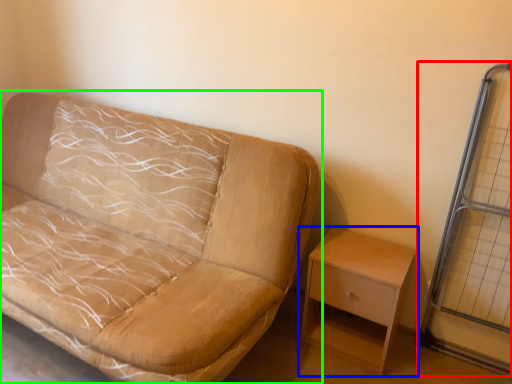
Question: Considering the real-world distances, which object is closest to glass door (highlighted by a red box)? nightstand (highlighted by a blue box) or studio couch (highlighted by a green box).

Choices:
 (A) nightstand
 (B) studio couch

Answer: (A)